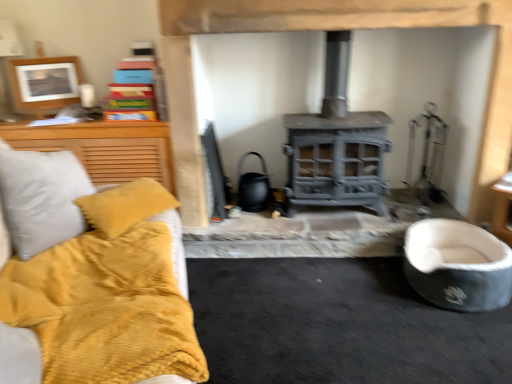
Question: Does soft gray fabric pet bed at lower right come behind wooden picture frame at upper left?

Choices:
 (A) yes
 (B) no

Answer: (B)

Question: Is wooden picture frame at upper left located within soft gray fabric pet bed at lower right?

Choices:
 (A) yes
 (B) no

Answer: (B)

Question: Could you tell me if soft gray fabric pet bed at lower right is turned towards wooden picture frame at upper left?

Choices:
 (A) yes
 (B) no

Answer: (B)

Question: Are soft gray fabric pet bed at lower right and wooden picture frame at upper left located far from each other?

Choices:
 (A) yes
 (B) no

Answer: (A)

Question: Is soft gray fabric pet bed at lower right wider than wooden picture frame at upper left?

Choices:
 (A) yes
 (B) no

Answer: (A)

Question: From the image's perspective, is soft gray fabric pet bed at lower right on wooden picture frame at upper left?

Choices:
 (A) no
 (B) yes

Answer: (A)

Question: Can you confirm if gray metallic fireplace at center is bigger than soft gray fabric pet bed at lower right?

Choices:
 (A) no
 (B) yes

Answer: (B)

Question: Is gray metallic fireplace at center taller than soft gray fabric pet bed at lower right?

Choices:
 (A) yes
 (B) no

Answer: (A)

Question: Is gray metallic fireplace at center next to soft gray fabric pet bed at lower right and touching it?

Choices:
 (A) no
 (B) yes

Answer: (A)

Question: Considering the relative sizes of gray metallic fireplace at center and soft gray fabric pet bed at lower right in the image provided, is gray metallic fireplace at center smaller than soft gray fabric pet bed at lower right?

Choices:
 (A) no
 (B) yes

Answer: (A)

Question: From the image's perspective, is gray metallic fireplace at center located beneath soft gray fabric pet bed at lower right?

Choices:
 (A) yes
 (B) no

Answer: (B)

Question: Is the depth of gray metallic fireplace at center less than that of soft gray fabric pet bed at lower right?

Choices:
 (A) no
 (B) yes

Answer: (A)

Question: From the image's perspective, is soft gray fabric pet bed at lower right located above gray metallic fireplace at center?

Choices:
 (A) yes
 (B) no

Answer: (B)